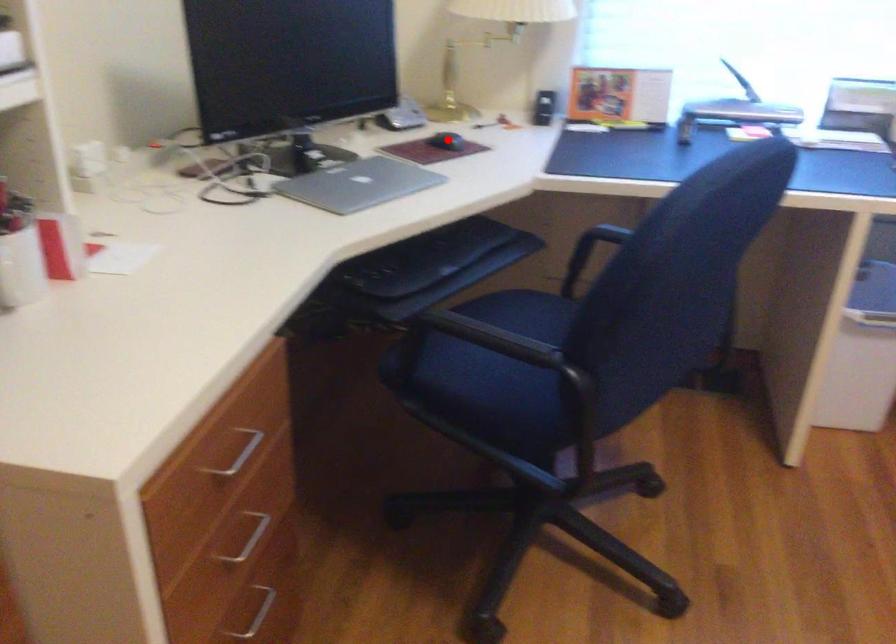
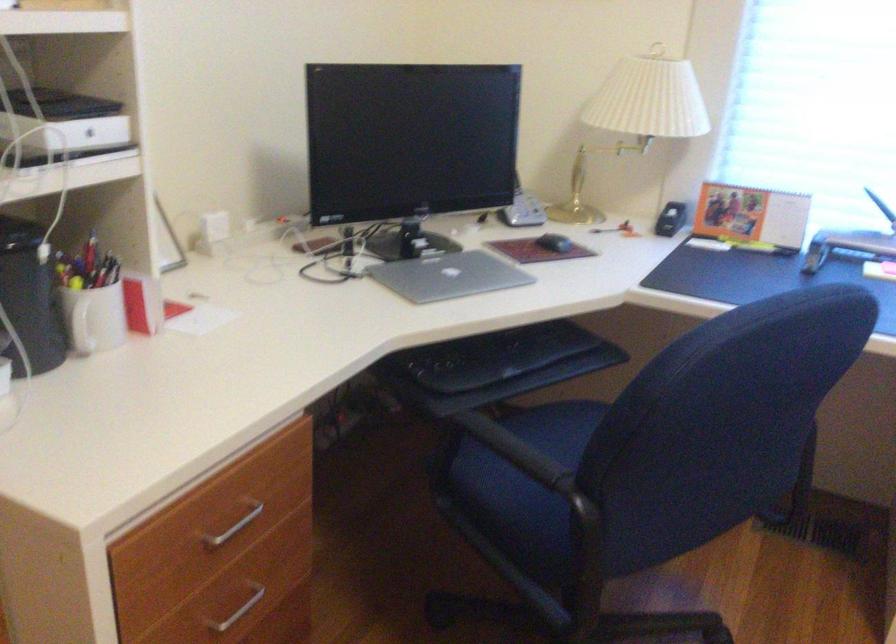
The point at the highlighted location is marked in the first image. Where is the corresponding point in the second image?

(554, 243)